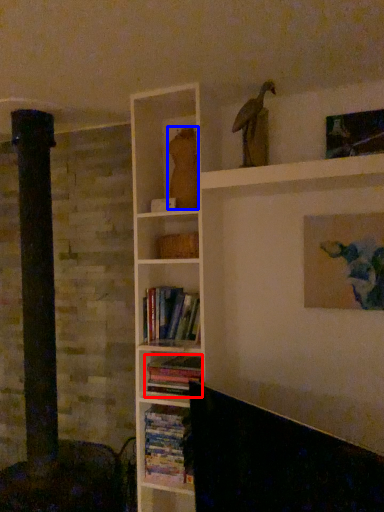
Question: Among these objects, which one is nearest to the camera, book (highlighted by a red box) or animal (highlighted by a blue box)?

Choices:
 (A) book
 (B) animal

Answer: (A)